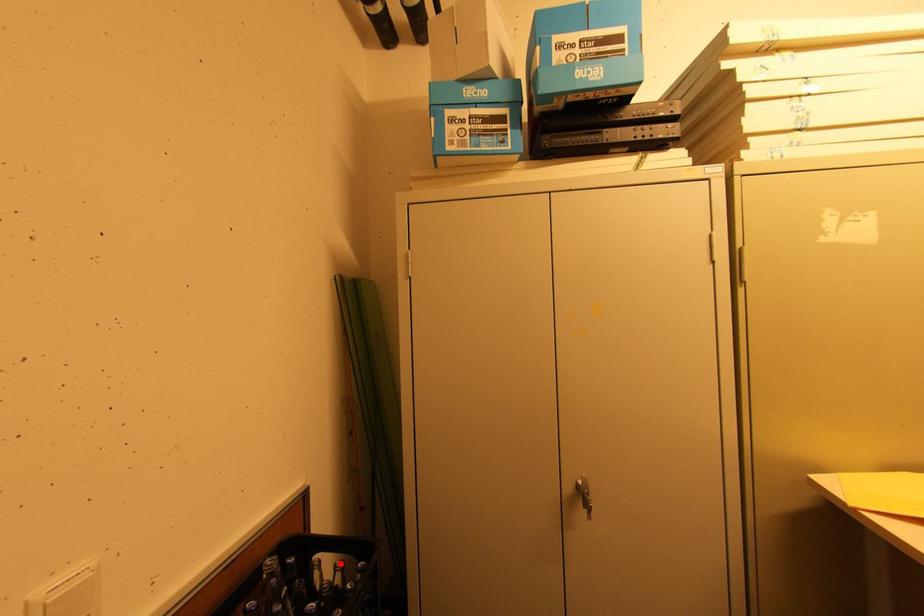
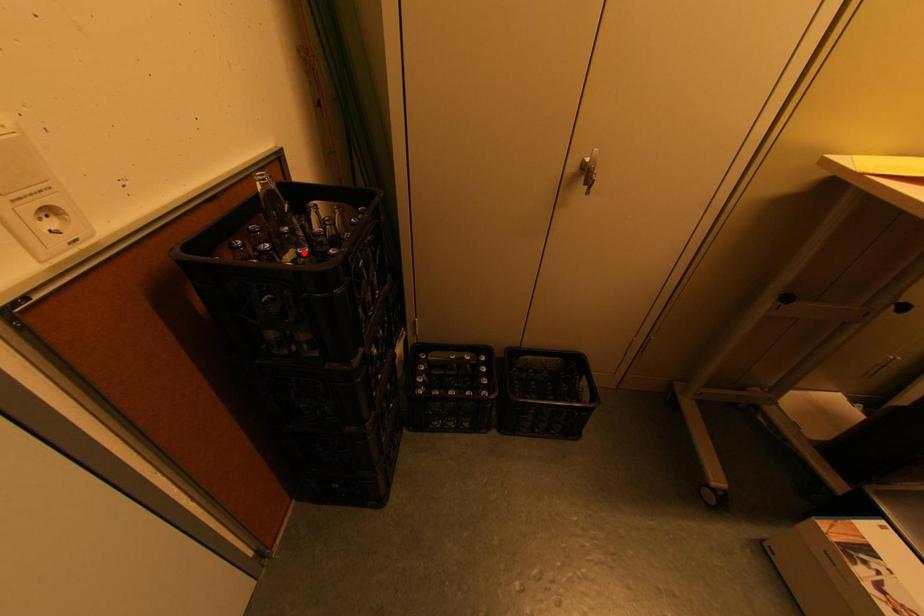
I am providing you with two images of the same scene from different viewpoints. A red point is marked on the first image and another point is marked on the second image. Is the marked point in image1 the same physical position as the marked point in image2?

No